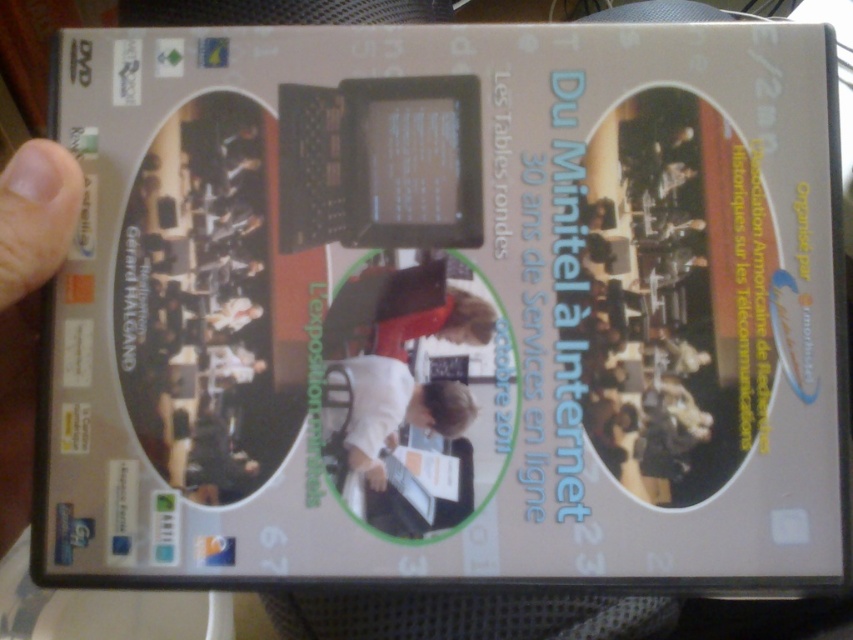
Question: Does white fabric shirt at center have a greater width compared to matte skin hand at lower left?

Choices:
 (A) no
 (B) yes

Answer: (B)

Question: Which point appears farthest from the camera in this image?

Choices:
 (A) (422, 416)
 (B) (381, 477)
 (C) (21, 220)

Answer: (A)

Question: Is matte skin hand at lower left below white matte hand at lower center?

Choices:
 (A) no
 (B) yes

Answer: (A)

Question: Is matte skin hand at lower left smaller than white matte hand at lower center?

Choices:
 (A) yes
 (B) no

Answer: (B)

Question: Which point is farther from the camera taking this photo?

Choices:
 (A) (360, 385)
 (B) (57, 172)
 (C) (368, 470)

Answer: (A)

Question: Which is nearer to the matte skin hand at lower left?

Choices:
 (A) white fabric shirt at center
 (B) white matte hand at lower center

Answer: (A)